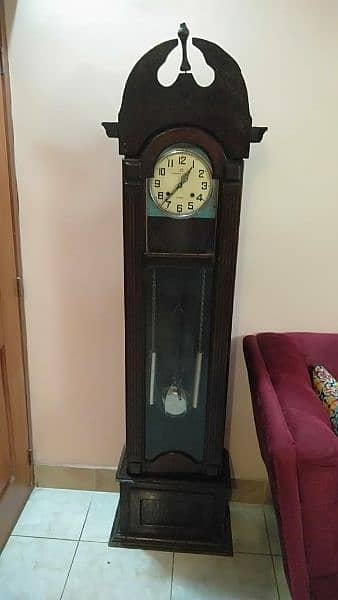
Identify the location of door. (15, 497).